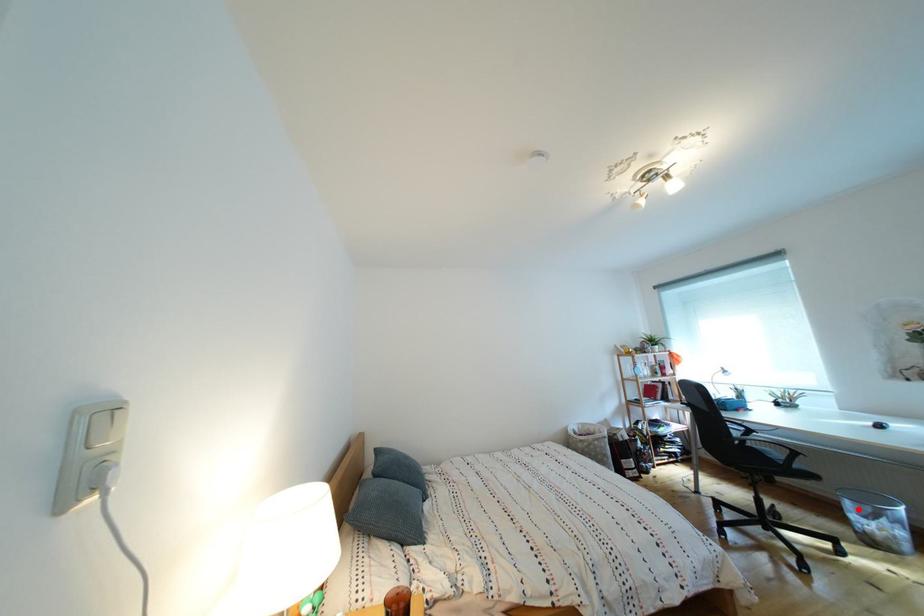
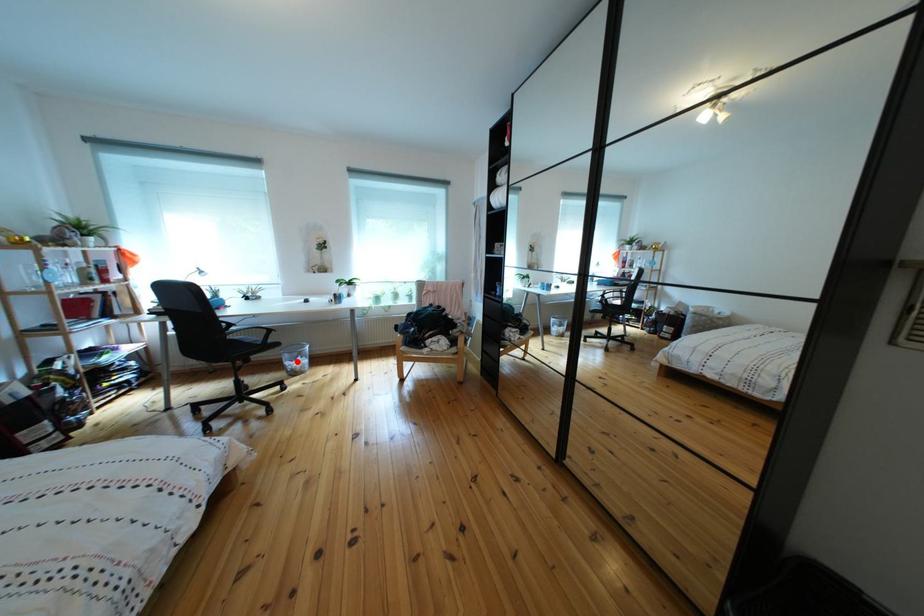
I am providing you with two images of the same scene from different viewpoints. A red point is marked on the first image and another point is marked on the second image. Are the points marked in image1 and image2 representing the same 3D position?

Yes